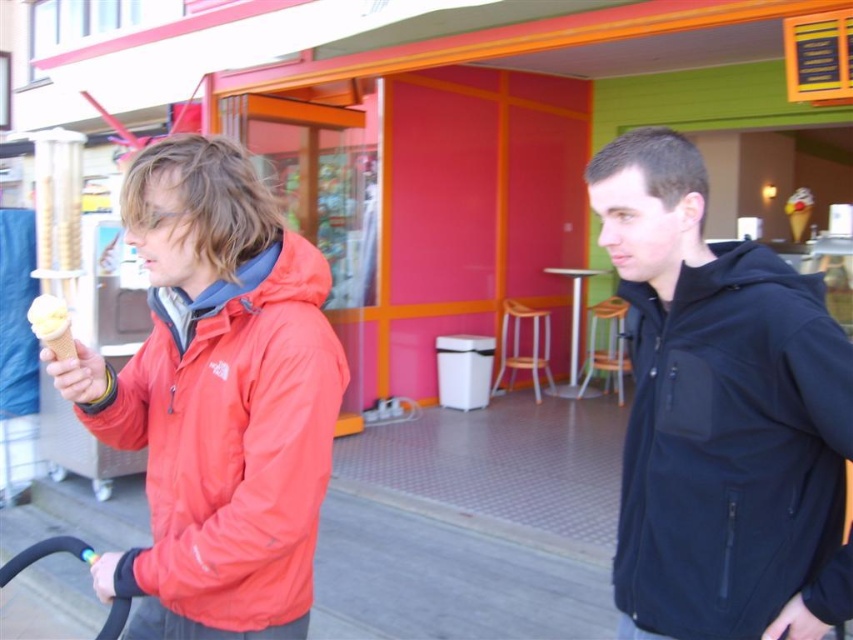
Between matte red jacket at left and vanilla ice cream in waffle cone at left, which one appears on the right side from the viewer's perspective?

From the viewer's perspective, matte red jacket at left appears more on the right side.

Who is more forward, (x=177, y=600) or (x=49, y=308)?

Point (x=49, y=308) is in front.

What do you see at coordinates (230, 440) in the screenshot?
I see `matte red jacket at left` at bounding box center [230, 440].

Find the location of `matte red jacket at left`. matte red jacket at left is located at coordinates (230, 440).

Can you confirm if vanilla ice cream in waffle cone at left is positioned to the left of yellow waffle cone at right?

Indeed, vanilla ice cream in waffle cone at left is positioned on the left side of yellow waffle cone at right.

Who is taller, vanilla ice cream in waffle cone at left or yellow waffle cone at right?

yellow waffle cone at right is taller.

You are a GUI agent. You are given a task and a screenshot of the screen. Output one action in this format:
    pyautogui.click(x=<x>, y=<y>)
    Task: Click on the vanilla ice cream in waffle cone at left
    
    Given the screenshot: What is the action you would take?
    pyautogui.click(x=51, y=324)

Identify the location of vanilla ice cream in waffle cone at left. (51, 324).

Find the location of `matte red jacket at left`. matte red jacket at left is located at coordinates (230, 440).

In the scene shown: Can you confirm if matte red jacket at left is taller than yellow waffle cone at right?

Yes, matte red jacket at left is taller than yellow waffle cone at right.

Locate an element on the screen. The width and height of the screenshot is (853, 640). matte red jacket at left is located at coordinates pyautogui.click(x=230, y=440).